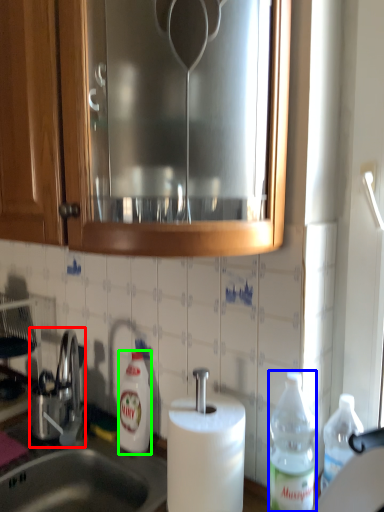
Question: Based on their relative distances, which object is farther from tap (highlighted by a red box)? Choose from bottle (highlighted by a blue box) and bottle (highlighted by a green box).

Choices:
 (A) bottle
 (B) bottle

Answer: (A)